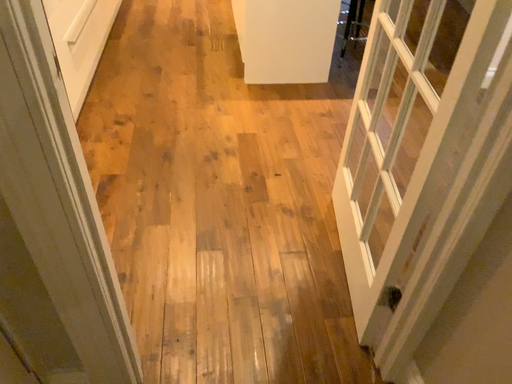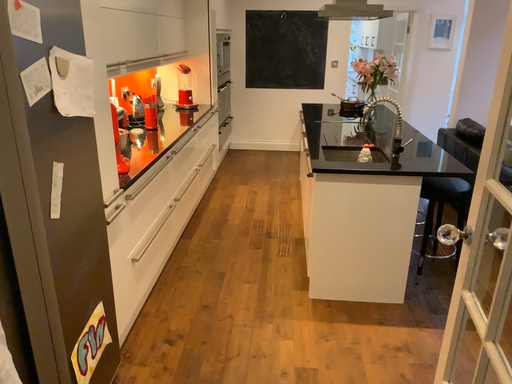
Question: How did the camera likely rotate when shooting the video?

Choices:
 (A) rotated left
 (B) rotated right

Answer: (A)